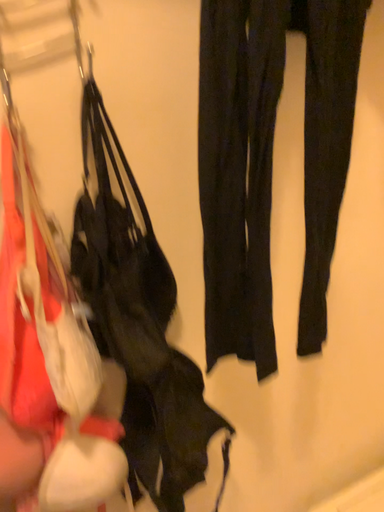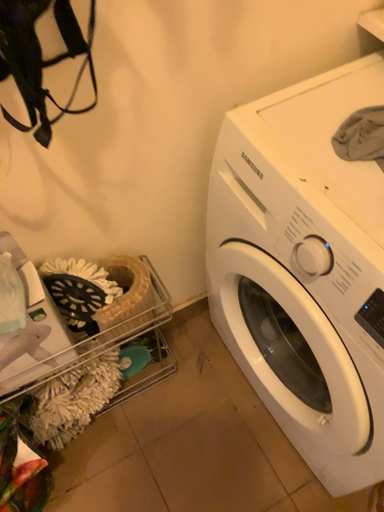
Question: How did the camera likely rotate when shooting the video?

Choices:
 (A) rotated downward
 (B) rotated upward

Answer: (A)